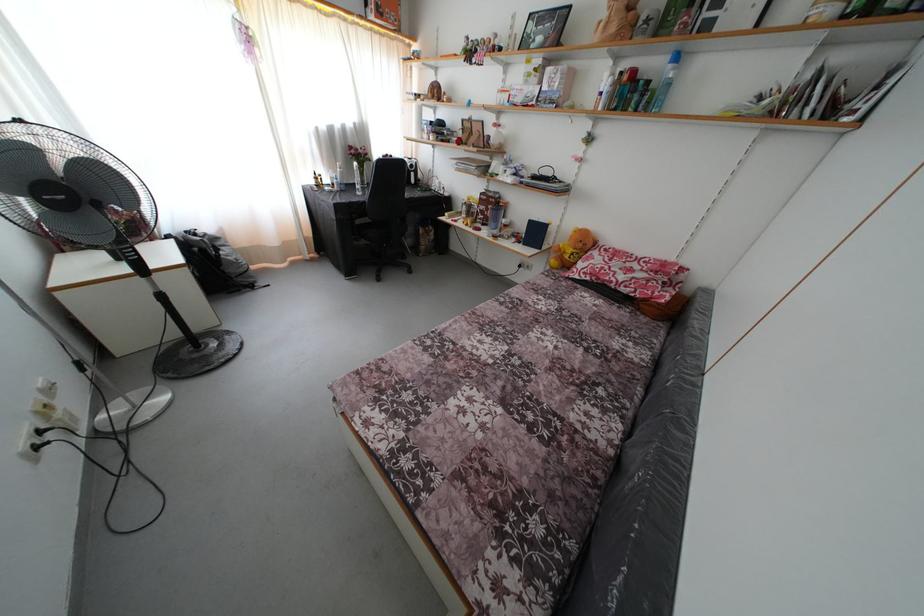
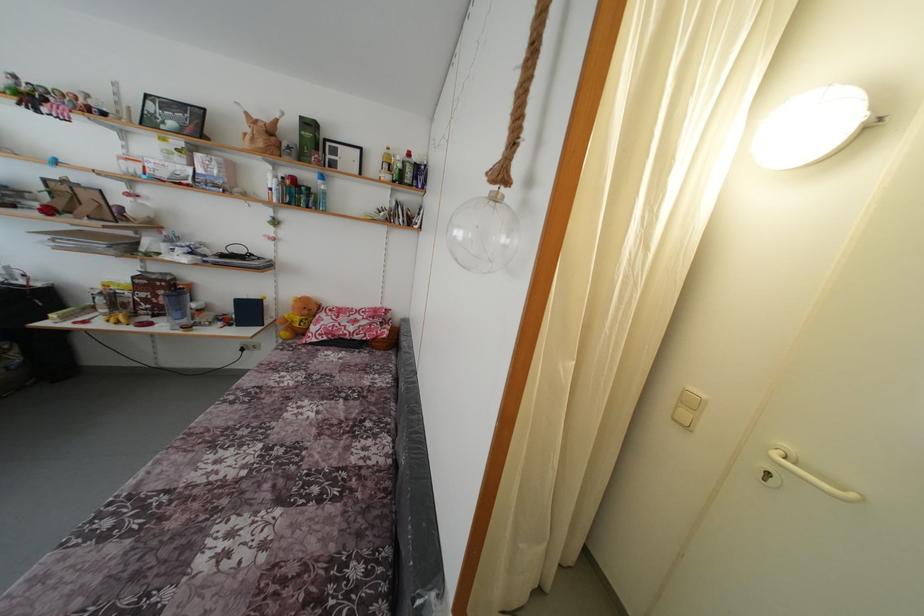
Locate, in the second image, the point that corresponds to [585,251] in the first image.

(310, 317)